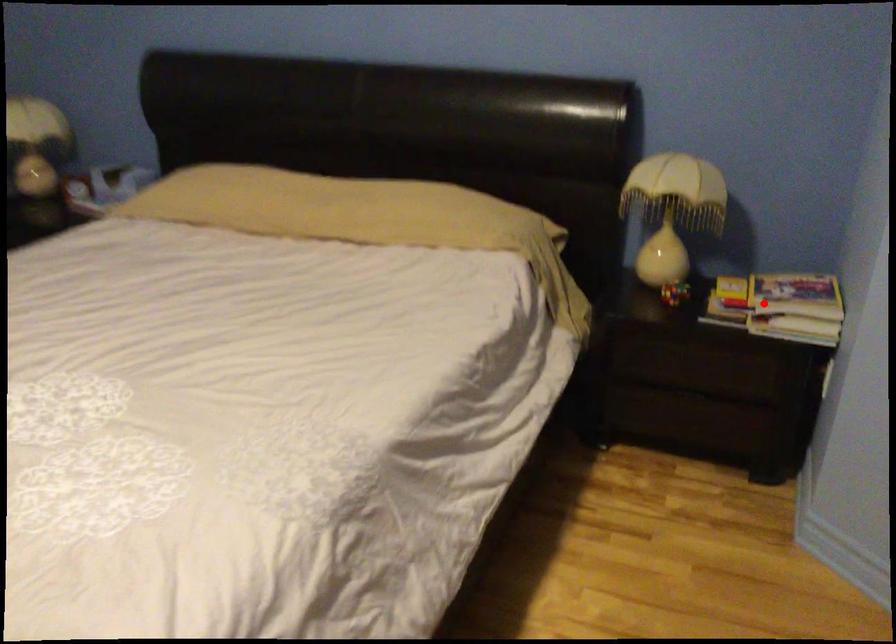
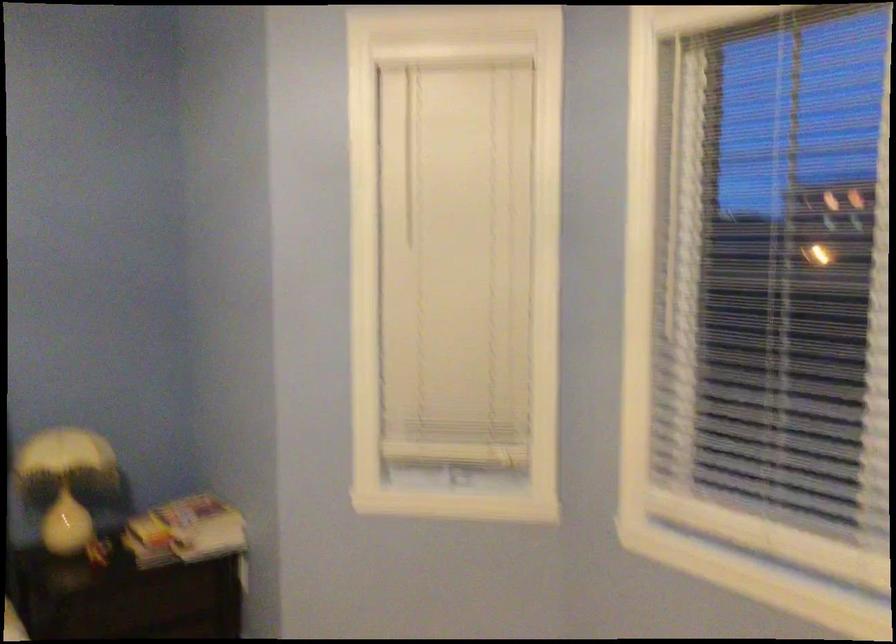
Question: I am providing you with two images of the same scene from different viewpoints. Given a red point in image1, look at the same physical point in image2. Is it:

Choices:
 (A) Closer to the viewpoint
 (B) Farther from the viewpoint

Answer: (B)